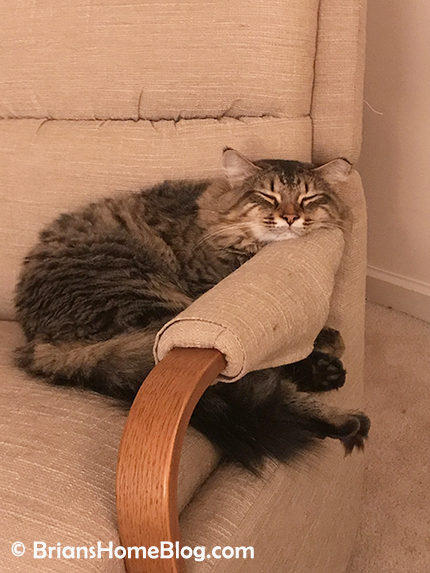
You are a GUI agent. You are given a task and a screenshot of the screen. Output one action in this format:
    pyautogui.click(x=<x>, y=<y>)
    Task: Click on the chair
    The width and height of the screenshot is (430, 573).
    Given the screenshot: What is the action you would take?
    pyautogui.click(x=39, y=443)